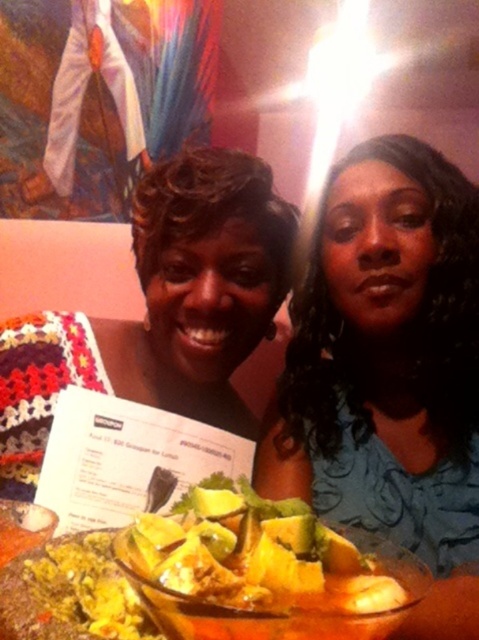
Which is more to the right, yellowish tortilla chips at center or white paper menu at center?

From the viewer's perspective, yellowish tortilla chips at center appears more on the right side.

Does yellowish tortilla chips at center have a greater width compared to white paper menu at center?

In fact, yellowish tortilla chips at center might be narrower than white paper menu at center.

Who is more distant from viewer, [243,588] or [110,509]?

Positioned behind is point [110,509].

You are a GUI agent. You are given a task and a screenshot of the screen. Output one action in this format:
    pyautogui.click(x=<x>, y=<y>)
    Task: Click on the yellowish tortilla chips at center
    
    Given the screenshot: What is the action you would take?
    pyautogui.click(x=258, y=570)

Is point (310, 280) more distant than point (214, 208)?

Yes, it is behind point (214, 208).

Between blue satin dress at center and matte black sweater at center, which one has less height?

Standing shorter between the two is matte black sweater at center.

Which is behind, point (385, 339) or point (195, 340)?

The point (385, 339) is behind.

The width and height of the screenshot is (479, 640). In order to click on blue satin dress at center in this screenshot , I will do `click(386, 356)`.

Is blue satin dress at center to the left of white paper menu at center from the viewer's perspective?

No, blue satin dress at center is not to the left of white paper menu at center.

From the picture: Is blue satin dress at center smaller than white paper menu at center?

Incorrect, blue satin dress at center is not smaller in size than white paper menu at center.

Find the location of `blue satin dress at center`. blue satin dress at center is located at coordinates (386, 356).